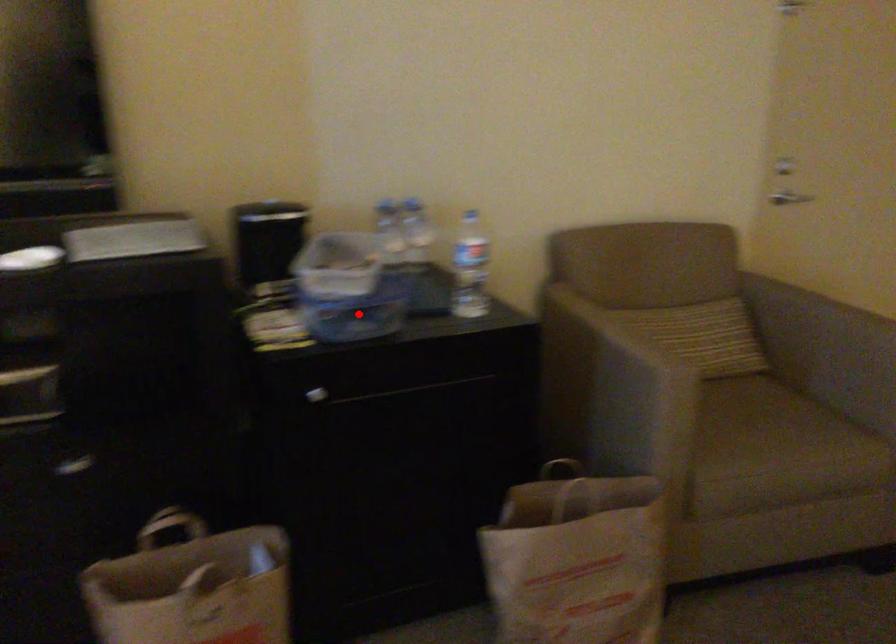
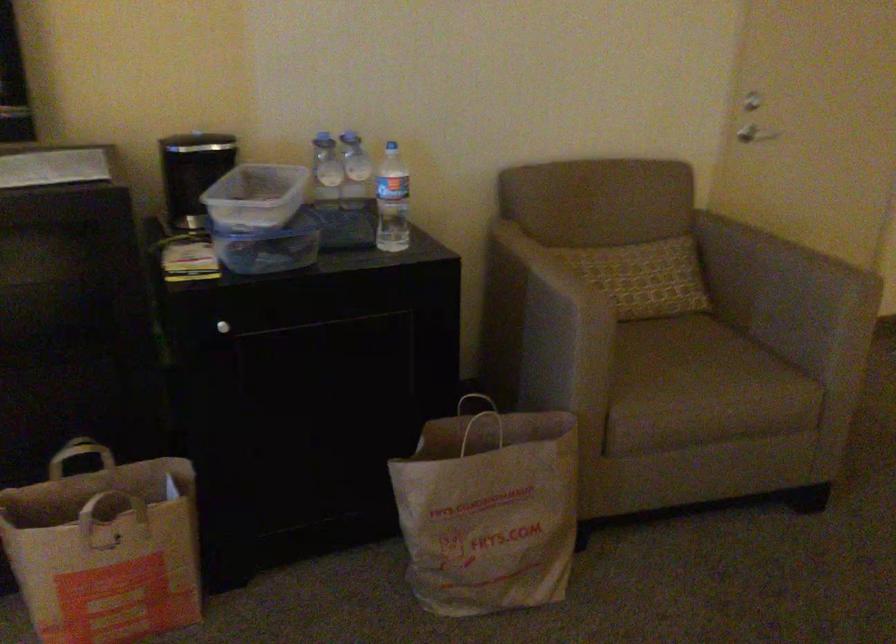
In the second image, find the point that corresponds to the highlighted location in the first image.

(269, 245)